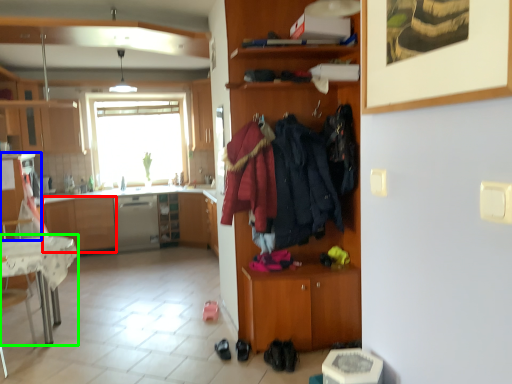
Question: Estimate the real-world distances between objects in this image. Which object is farther from cabinetry (highlighted by a red box), cabinetry (highlighted by a blue box) or desk (highlighted by a green box)?

Choices:
 (A) cabinetry
 (B) desk

Answer: (B)